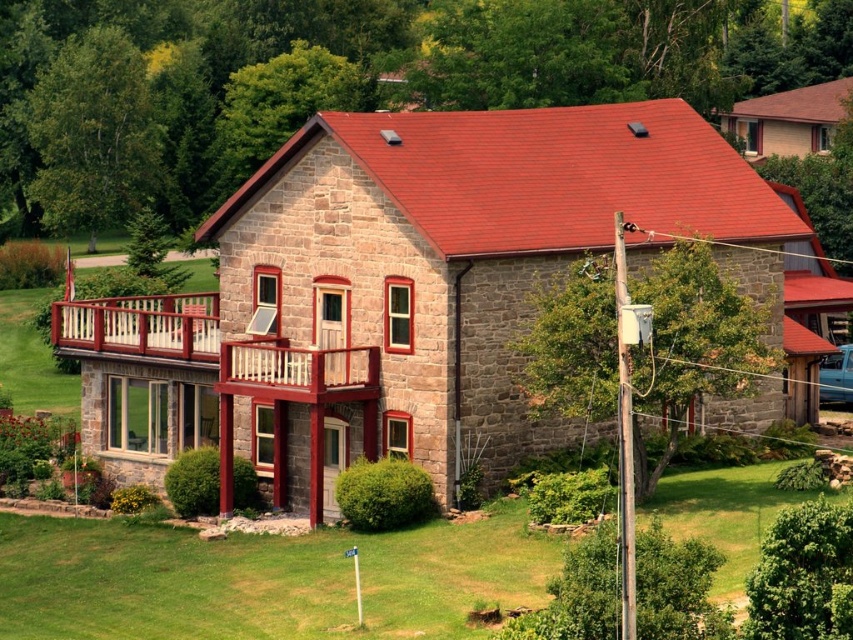
You are standing in front of the two story stone house and want to walk from the wooden railing at upper left to the wooden railing balcony at center. Which direction should you move to get there?

You should move to the right to reach the wooden railing balcony at center from the wooden railing at upper left since the wooden railing at upper left is on the left side of the wooden railing balcony at center.

You are a painter planning to paint the wooden railings of the house. You have two types of paint cans available. One is sufficient for 2 meters and the other for 3 meters of railing. Given the wooden railing at upper left and wooden railing balcony at center, which railing requires the larger paint can based on their widths?

The wooden railing at upper left requires the larger paint can because its width is greater than the wooden railing balcony at center, as stated in the description.